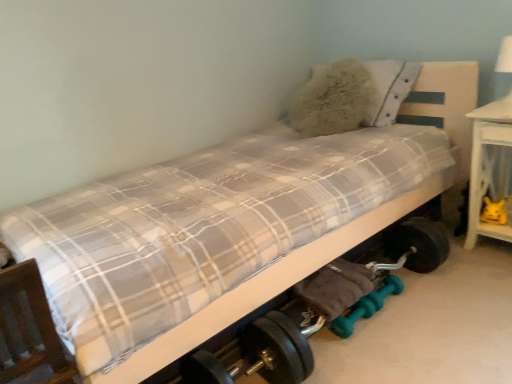
This screenshot has height=384, width=512. What do you see at coordinates (503, 69) in the screenshot?
I see `white glossy table lamp at upper right` at bounding box center [503, 69].

Identify the location of white wood table at right. (489, 166).

At what (x,y) coordinates should I click in order to perform the action: click on fluffy white pillow at upper right. Please return your answer as a coordinate pair (x, y). Looking at the image, I should click on (352, 96).

You are a GUI agent. You are given a task and a screenshot of the screen. Output one action in this format:
    pyautogui.click(x=<x>, y=<y>)
    Task: Click on the white glossy table lamp at upper right
    Image resolution: width=512 pixels, height=384 pixels.
    Given the screenshot: What is the action you would take?
    pyautogui.click(x=503, y=69)

The image size is (512, 384). Find the location of `table lying below the fluffy white pillow at upper right (from the image's perspective)`. table lying below the fluffy white pillow at upper right (from the image's perspective) is located at coordinates (489, 166).

Which of these two, white wood table at right or fluffy white pillow at upper right, is smaller?

Smaller between the two is white wood table at right.

Would you say white wood table at right is inside or outside fluffy white pillow at upper right?

white wood table at right is spatially situated outside fluffy white pillow at upper right.

Does white wood table at right turn towards fluffy white pillow at upper right?

No, white wood table at right is not oriented towards fluffy white pillow at upper right.

Is point (357, 286) more distant than point (504, 206)?

No.

Can you confirm if teal rubber dumbbells at lower center is shorter than yellow plush toy at lower right?

No.

From the image's perspective, who appears lower, teal rubber dumbbells at lower center or yellow plush toy at lower right?

From the image's view, teal rubber dumbbells at lower center is below.

Considering the relative positions of teal rubber dumbbells at lower center and yellow plush toy at lower right in the image provided, is teal rubber dumbbells at lower center to the left or to the right of yellow plush toy at lower right?

teal rubber dumbbells at lower center is positioned on yellow plush toy at lower right's left side.

In the scene shown: Is wooden bed frame at lower left oriented towards teal rubber dumbbells at lower center?

No, wooden bed frame at lower left is not turned towards teal rubber dumbbells at lower center.

Between wooden bed frame at lower left and teal rubber dumbbells at lower center, which one appears on the left side from the viewer's perspective?

wooden bed frame at lower left.

Relative to teal rubber dumbbells at lower center, is wooden bed frame at lower left in front or behind?

Visually, wooden bed frame at lower left is located in front of teal rubber dumbbells at lower center.

Which is less distant, (7, 282) or (242, 336)?

Point (7, 282) is positioned closer to the camera compared to point (242, 336).

Does fluffy white pillow at upper right have a greater width compared to wooden bed frame at lower left?

Correct, the width of fluffy white pillow at upper right exceeds that of wooden bed frame at lower left.

Considering the positions of point (328, 66) and point (1, 314), is point (328, 66) closer or farther from the camera than point (1, 314)?

Clearly, point (328, 66) is more distant from the camera than point (1, 314).

Considering the relative sizes of fluffy white pillow at upper right and wooden bed frame at lower left in the image provided, is fluffy white pillow at upper right smaller than wooden bed frame at lower left?

Yes.

Is fluffy white pillow at upper right aimed at wooden bed frame at lower left?

Yes, fluffy white pillow at upper right is aimed at wooden bed frame at lower left.

Who is more distant, fluffy white pillow at upper right or yellow plush toy at lower right?

fluffy white pillow at upper right is further away from the camera.

From a real-world perspective, relative to yellow plush toy at lower right, is fluffy white pillow at upper right vertically above or below?

Clearly, from a real-world perspective, fluffy white pillow at upper right is above yellow plush toy at lower right.

From the picture: Is fluffy white pillow at upper right oriented away from yellow plush toy at lower right?

No, fluffy white pillow at upper right is not facing the opposite direction of yellow plush toy at lower right.

Is fluffy white pillow at upper right to the right of yellow plush toy at lower right from the viewer's perspective?

No.

From the image's perspective, is white wood table at right under teal rubber dumbbells at lower center?

No, from the image's perspective, white wood table at right is not beneath teal rubber dumbbells at lower center.

Is white wood table at right oriented towards teal rubber dumbbells at lower center?

Yes, white wood table at right is facing teal rubber dumbbells at lower center.

Can you confirm if white wood table at right is taller than teal rubber dumbbells at lower center?

Correct, white wood table at right is much taller as teal rubber dumbbells at lower center.

Which of these two, white wood table at right or teal rubber dumbbells at lower center, is bigger?

With larger size is teal rubber dumbbells at lower center.

Between white glossy table lamp at upper right and fluffy white pillow at upper right, which one has larger width?

With larger width is fluffy white pillow at upper right.

Considering the sizes of white glossy table lamp at upper right and fluffy white pillow at upper right in the image, is white glossy table lamp at upper right bigger or smaller than fluffy white pillow at upper right?

white glossy table lamp at upper right is smaller than fluffy white pillow at upper right.

In the scene shown: Which object is closer to the camera, white glossy table lamp at upper right or fluffy white pillow at upper right?

Positioned in front is white glossy table lamp at upper right.

How many degrees apart are the facing directions of white glossy table lamp at upper right and fluffy white pillow at upper right?

They differ by 1.05 degrees in their facing directions.

Where is `pillow on the left of white wood table at right`? The height and width of the screenshot is (384, 512). pillow on the left of white wood table at right is located at coordinates pos(352,96).

Identify the location of toy above the teal rubber dumbbells at lower center (from the image's perspective). This screenshot has height=384, width=512. 493,211.

Based on their spatial positions, is yellow plush toy at lower right or white glossy table lamp at upper right closer to fluffy white pillow at upper right?

Based on the image, white glossy table lamp at upper right appears to be nearer to fluffy white pillow at upper right.

Looking at this image, based on their spatial positions, is teal rubber dumbbells at lower center or white wood table at right further from fluffy white pillow at upper right?

teal rubber dumbbells at lower center.

Estimate the real-world distances between objects in this image. Which object is further from white wood table at right, wooden bed frame at lower left or white glossy table lamp at upper right?

wooden bed frame at lower left is further to white wood table at right.

Looking at the image, which one is located closer to white glossy table lamp at upper right, white wood table at right or wooden bed frame at lower left?

The object closer to white glossy table lamp at upper right is white wood table at right.

Which object lies nearer to the anchor point fluffy white pillow at upper right, wooden bed frame at lower left or white glossy table lamp at upper right?

Among the two, white glossy table lamp at upper right is located nearer to fluffy white pillow at upper right.

When comparing their distances from fluffy white pillow at upper right, does white wood table at right or wooden bed frame at lower left seem further?

Among the two, wooden bed frame at lower left is located further to fluffy white pillow at upper right.

Considering their positions, is yellow plush toy at lower right positioned closer to white glossy table lamp at upper right than fluffy white pillow at upper right?

The object closer to white glossy table lamp at upper right is yellow plush toy at lower right.

Estimate the real-world distances between objects in this image. Which object is further from teal rubber dumbbells at lower center, fluffy white pillow at upper right or white glossy table lamp at upper right?

Based on the image, white glossy table lamp at upper right appears to be further to teal rubber dumbbells at lower center.

This screenshot has height=384, width=512. Identify the location of table lamp situated between wooden bed frame at lower left and white wood table at right from left to right. (503, 69).

Identify the location of pillow between wooden bed frame at lower left and white wood table at right. (352, 96).

Locate an element on the screen. The height and width of the screenshot is (384, 512). toy situated between teal rubber dumbbells at lower center and white wood table at right from left to right is located at coordinates (493, 211).

This screenshot has height=384, width=512. Find the location of `table lamp situated between wooden bed frame at lower left and yellow plush toy at lower right from left to right`. table lamp situated between wooden bed frame at lower left and yellow plush toy at lower right from left to right is located at coordinates (503, 69).